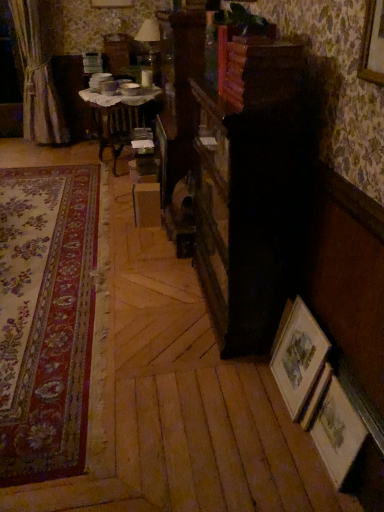
Locate an element on the screen. free location in front of silky beige curtain at left is located at coordinates (36, 154).